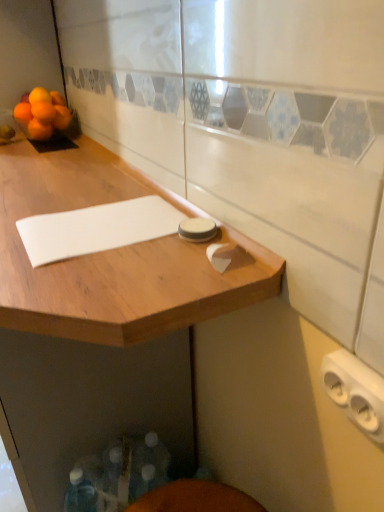
What do you see at coordinates (39, 130) in the screenshot?
I see `orange matte at upper left, acting as the third orange starting from the right` at bounding box center [39, 130].

Where is `orange matte tangerine at upper left`? Image resolution: width=384 pixels, height=512 pixels. orange matte tangerine at upper left is located at coordinates (61, 117).

This screenshot has height=512, width=384. What do you see at coordinates (43, 111) in the screenshot?
I see `orange matte at upper left, the 4th orange in the left-to-right sequence` at bounding box center [43, 111].

The image size is (384, 512). Describe the element at coordinates (356, 391) in the screenshot. I see `white plastic outlet at lower right` at that location.

Where is `wooden cutting board at upper left`? The height and width of the screenshot is (512, 384). wooden cutting board at upper left is located at coordinates (112, 257).

Which of these two, wooden cutting board at upper left or orange matte at upper left, which is counted as the 3th orange, starting from the left, stands taller?

With more height is wooden cutting board at upper left.

Is wooden cutting board at upper left beside orange matte at upper left, which is counted as the 3th orange, starting from the left?

No, wooden cutting board at upper left is not beside orange matte at upper left, which is counted as the 3th orange, starting from the left.

Which object is closer to the camera, wooden cutting board at upper left or orange matte at upper left, which is counted as the 3th orange, starting from the left?

wooden cutting board at upper left is in front.

How much distance is there between wooden cutting board at upper left and white matte notepad at center?

They are 11.04 centimeters apart.

Is wooden cutting board at upper left oriented away from white matte notepad at center?

No, white matte notepad at center is not at the back of wooden cutting board at upper left.

Does wooden cutting board at upper left contain white matte notepad at center?

Yes, wooden cutting board at upper left contains white matte notepad at center.

Looking at this image, from the image's perspective, which one is positioned higher, wooden cutting board at upper left or white matte notepad at center?

From the image's view, white matte notepad at center is above.

Based on their sizes in the image, would you say wooden cutting board at upper left is bigger or smaller than orange matte at upper left, positioned as the second orange in left-to-right order?

In the image, wooden cutting board at upper left appears to be larger than orange matte at upper left, positioned as the second orange in left-to-right order.

Which object is further away from the camera, wooden cutting board at upper left or orange matte at upper left, acting as the third orange starting from the right?

orange matte at upper left, acting as the third orange starting from the right, is more distant.

From the picture: Would you say wooden cutting board at upper left is to the left or to the right of orange matte at upper left, acting as the third orange starting from the right, in the picture?

In the image, wooden cutting board at upper left appears on the right side of orange matte at upper left, acting as the third orange starting from the right.

From the image's perspective, between white plastic outlet at lower right and orange matte at upper left, which is counted as the 3th orange, starting from the left, which one is located above?

orange matte at upper left, which is counted as the 3th orange, starting from the left, appears higher in the image.

Is white plastic outlet at lower right looking in the opposite direction of orange matte at upper left, which is counted as the 3th orange, starting from the left?

No, white plastic outlet at lower right is not facing the opposite direction of orange matte at upper left, which is counted as the 3th orange, starting from the left.

How much distance is there between white plastic outlet at lower right and orange matte at upper left, which is counted as the 3th orange, starting from the left?

They are 1.33 meters apart.

Consider the image. Is white plastic outlet at lower right closer to the viewer compared to orange matte at upper left, which is the second orange in right-to-left order?

Yes, white plastic outlet at lower right is in front of orange matte at upper left, which is the second orange in right-to-left order.

From a real-world perspective, which object rests below the other?

wooden cutting board at upper left, from a real-world perspective.

Looking at their sizes, would you say orange matte at upper left, positioned as the second orange in left-to-right order, is wider or thinner than wooden cutting board at upper left?

Clearly, orange matte at upper left, positioned as the second orange in left-to-right order, has less width compared to wooden cutting board at upper left.

Considering the positions of points (41, 134) and (199, 292), is point (41, 134) closer to camera compared to point (199, 292)?

No, it is behind (199, 292).

Does orange matte at upper left, acting as the third orange starting from the right, turn towards orange matte at upper left, the 4th orange in the left-to-right sequence?

No, orange matte at upper left, acting as the third orange starting from the right, does not turn towards orange matte at upper left, the 4th orange in the left-to-right sequence.

Does point (31, 123) come in front of point (50, 120)?

No.

Is orange matte at upper left, acting as the third orange starting from the right, to the left of orange matte at upper left, the 4th orange in the left-to-right sequence, from the viewer's perspective?

Indeed, orange matte at upper left, acting as the third orange starting from the right, is positioned on the left side of orange matte at upper left, the 4th orange in the left-to-right sequence.

Who is smaller, orange matte at upper left, positioned as the second orange in left-to-right order, or orange matte at left, positioned as the first orange in left-to-right order?

Smaller between the two is orange matte at upper left, positioned as the second orange in left-to-right order.

Is orange matte at upper left, positioned as the second orange in left-to-right order, aimed at orange matte at left, arranged as the fourth orange when viewed from the right?

No, orange matte at upper left, positioned as the second orange in left-to-right order, does not turn towards orange matte at left, arranged as the fourth orange when viewed from the right.

Can you confirm if orange matte at upper left, acting as the third orange starting from the right, is shorter than orange matte at left, positioned as the first orange in left-to-right order?

In fact, orange matte at upper left, acting as the third orange starting from the right, may be taller than orange matte at left, positioned as the first orange in left-to-right order.

Locate an element on the screen. Image resolution: width=384 pixels, height=512 pixels. countertop below the orange matte at upper left, which is counted as the 3th orange, starting from the left (from the image's perspective) is located at coordinates (112, 257).

At what (x,y) coordinates should I click in order to perform the action: click on notepad on the right side of wooden cutting board at upper left. Please return your answer as a coordinate pair (x, y). Looking at the image, I should click on (96, 228).

From the image, which object appears to be farther from orange matte at upper left, the 4th orange in the left-to-right sequence, orange matte tangerine at upper left or wooden cutting board at upper left?

Among the two, wooden cutting board at upper left is located further to orange matte at upper left, the 4th orange in the left-to-right sequence.

Based on the photo, which object lies further to the anchor point white plastic outlet at lower right, orange matte at upper left, acting as the third orange starting from the right, or orange matte at upper left, the 4th orange in the left-to-right sequence?

Based on the image, orange matte at upper left, the 4th orange in the left-to-right sequence, appears to be further to white plastic outlet at lower right.

Based on their spatial positions, is white matte notepad at center or orange matte tangerine at upper left further from white plastic outlet at lower right?

orange matte tangerine at upper left is further to white plastic outlet at lower right.

Estimate the real-world distances between objects in this image. Which object is closer to orange matte at left, arranged as the fourth orange when viewed from the right, orange matte at upper left, positioned as the second orange in left-to-right order, or orange matte at upper left, which ranks as the first orange in right-to-left order?

The object closer to orange matte at left, arranged as the fourth orange when viewed from the right, is orange matte at upper left, which ranks as the first orange in right-to-left order.

Estimate the real-world distances between objects in this image. Which object is further from wooden cutting board at upper left, orange matte at upper left, which is the second orange in right-to-left order, or white plastic outlet at lower right?

The object further to wooden cutting board at upper left is orange matte at upper left, which is the second orange in right-to-left order.

Looking at this image, looking at the image, which one is located closer to orange matte at left, arranged as the fourth orange when viewed from the right, white plastic outlet at lower right or wooden cutting board at upper left?

Based on the image, wooden cutting board at upper left appears to be nearer to orange matte at left, arranged as the fourth orange when viewed from the right.

Which object lies nearer to the anchor point orange matte at upper left, which is counted as the 3th orange, starting from the left, orange matte at upper left, positioned as the second orange in left-to-right order, or wooden cutting board at upper left?

Among the two, orange matte at upper left, positioned as the second orange in left-to-right order, is located nearer to orange matte at upper left, which is counted as the 3th orange, starting from the left.

Estimate the real-world distances between objects in this image. Which object is further from orange matte at upper left, the 4th orange in the left-to-right sequence, orange matte at upper left, acting as the third orange starting from the right, or wooden cutting board at upper left?

wooden cutting board at upper left lies further to orange matte at upper left, the 4th orange in the left-to-right sequence, than the other object.

Locate an element on the screen. This screenshot has width=384, height=512. knob located between wooden cutting board at upper left and orange matte tangerine at upper left in the depth direction is located at coordinates (356, 391).

Find the location of a particular element. Image resolution: width=384 pixels, height=512 pixels. notepad between white plastic outlet at lower right and orange matte tangerine at upper left along the z-axis is located at coordinates (96, 228).

Where is `notepad positioned between wooden cutting board at upper left and orange matte at upper left, which is the second orange in right-to-left order, from near to far`? notepad positioned between wooden cutting board at upper left and orange matte at upper left, which is the second orange in right-to-left order, from near to far is located at coordinates (96, 228).

Image resolution: width=384 pixels, height=512 pixels. Find the location of `orange between white plastic outlet at lower right and orange matte at left, positioned as the first orange in left-to-right order, along the z-axis`. orange between white plastic outlet at lower right and orange matte at left, positioned as the first orange in left-to-right order, along the z-axis is located at coordinates (43, 111).